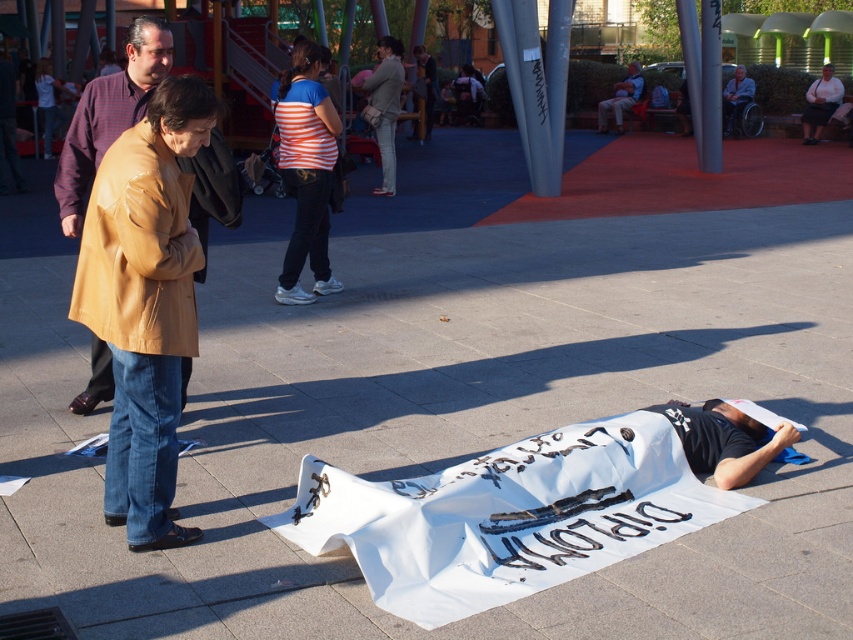
Question: Estimate the real-world distances between objects in this image. Which object is closer to the brown leather trench coat at left?

Choices:
 (A) white fabric purse at upper right
 (B) brown leather coat at center
 (C) striped fabric shirt at center

Answer: (B)

Question: Is brown leather trench coat at left behind white fabric purse at upper right?

Choices:
 (A) no
 (B) yes

Answer: (A)

Question: Where is white fabric purse at upper right located in relation to denim jacket at upper center in the image?

Choices:
 (A) below
 (B) above

Answer: (A)

Question: Which is farther from the striped shirt at upper center?

Choices:
 (A) denim jacket at upper center
 (B) brown leather trench coat at left
 (C) striped fabric shirt at center
 (D) brown leather coat at center

Answer: (B)

Question: Does brown leather coat at center lie behind striped fabric pants at center?

Choices:
 (A) no
 (B) yes

Answer: (A)

Question: Which object is positioned farthest from the denim jacket at upper center?

Choices:
 (A) brown leather trench coat at left
 (B) striped fabric shirt at center

Answer: (A)